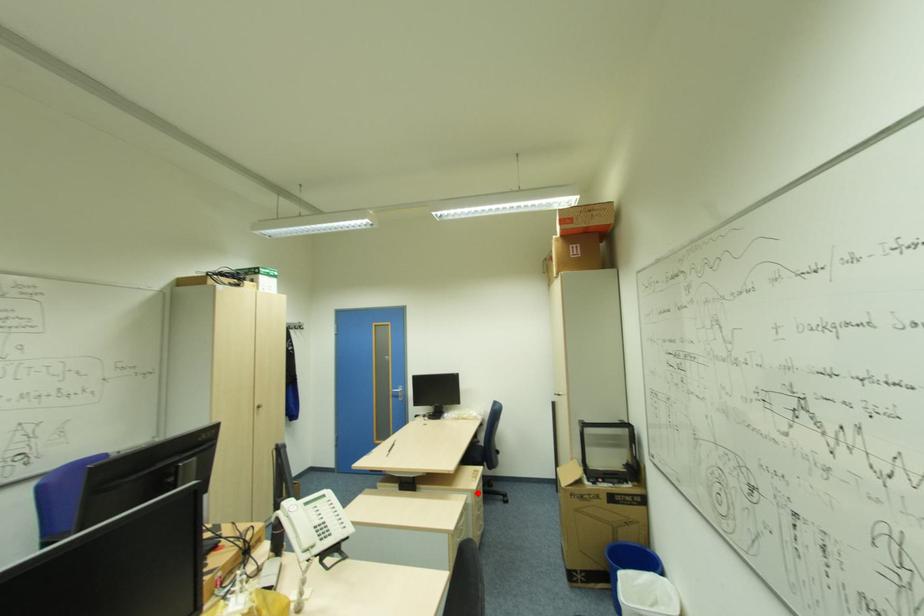
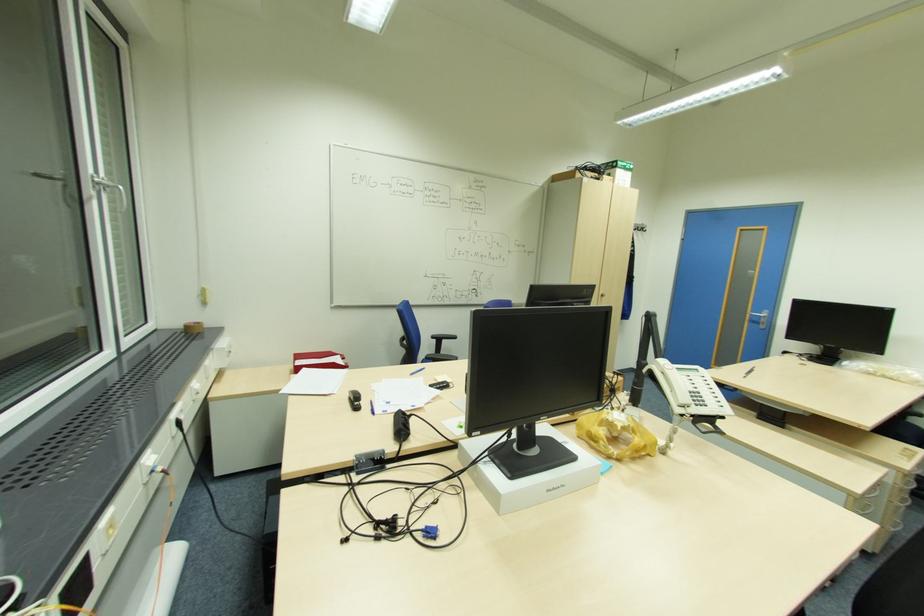
Find the pixel in the second image that matches the highlighted location in the first image.

(907, 474)